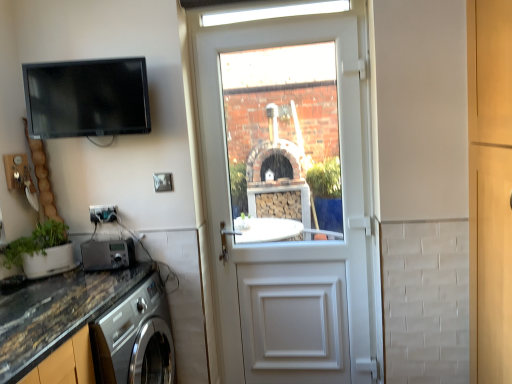
Where is `free space in front of green matte plant at lower left`? The width and height of the screenshot is (512, 384). free space in front of green matte plant at lower left is located at coordinates (28, 292).